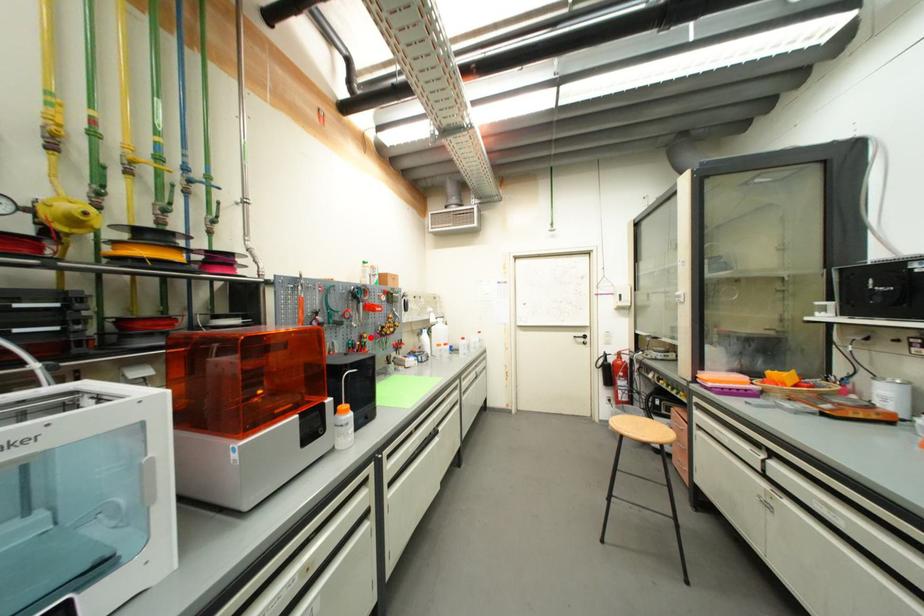
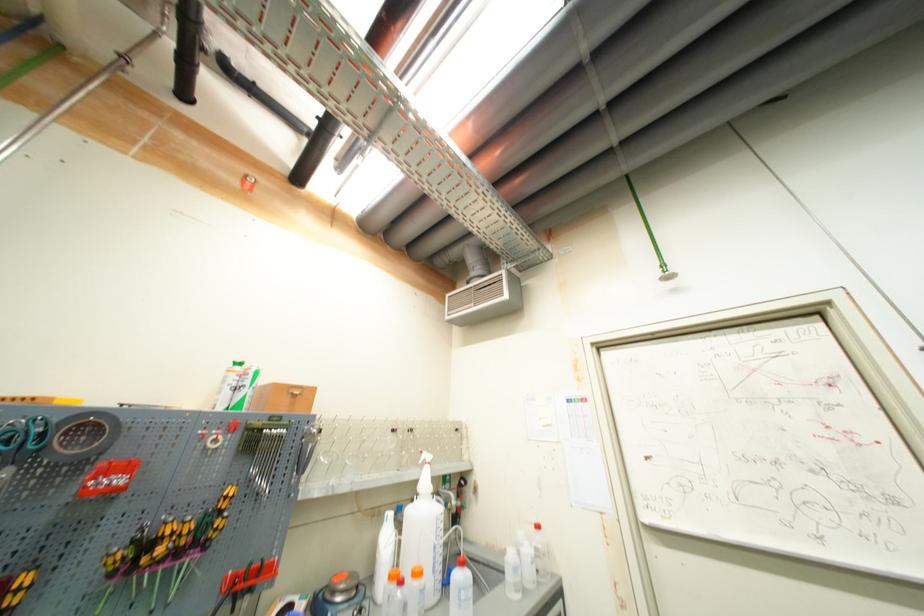
Question: A red point is marked in image1. In image2, is the corresponding 3D point closer to the camera or farther? Reply with the corresponding letter.

Choices:
 (A) The corresponding 3D point is closer.
 (B) The corresponding 3D point is farther.

Answer: (A)